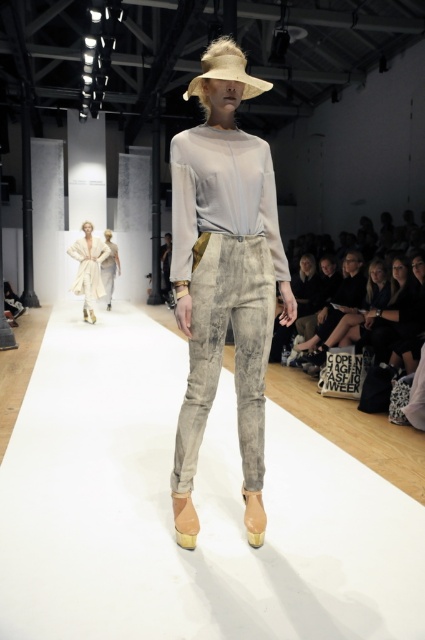
You are a fashion designer observing the runway show. You notice a point marked at coordinates (88, 268). What item of clothing is located at that point?

The point at coordinates (88, 268) indicates the location of the matte white coat at center.

You are a photographer at the runway show and need to capture a clear shot of the matte white coat at center and the light beige textured pants at center. Since the runway is white, which object might be harder to see and why?

The matte white coat at center might be harder to see because it is in front of the light beige textured pants at center, and since the runway is white, the coat could blend into the background.

Based on the photo, you are a photographer positioned at the front of the runway. You want to take a photo that includes both the model and two specific points marked in the image. The points are located at coordinates point (183, 97) and point (108, 273). Which point should you focus on first to ensure the model is in sharp focus?

Point (183, 97) is closer to the viewer than point (108, 273), so you should focus on point (183, 97) first to ensure the model is in sharp focus.